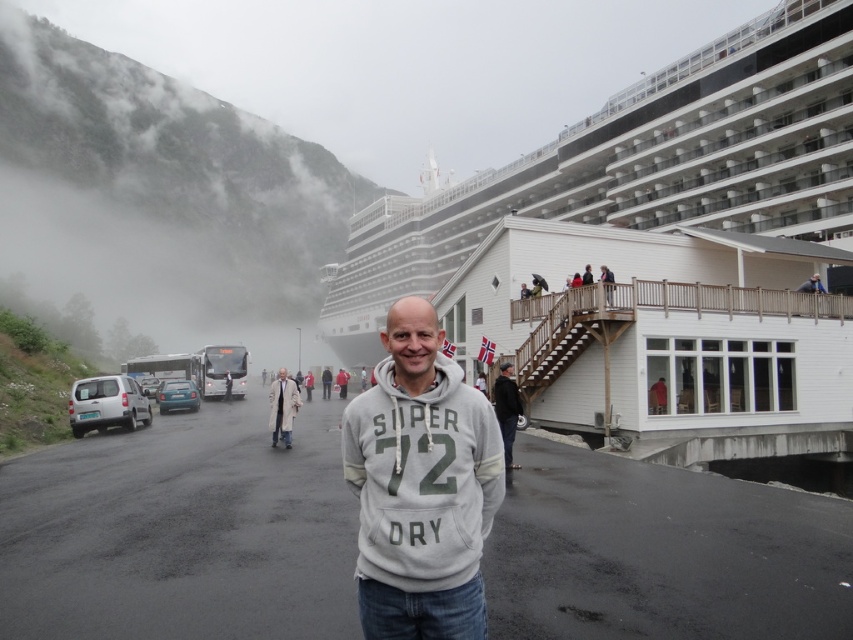
Is point (21, 220) less distant than point (120, 384)?

No.

Image resolution: width=853 pixels, height=640 pixels. I want to click on foggy misty mountain at upper left, so click(x=160, y=196).

Where is `foggy misty mountain at upper left`? The width and height of the screenshot is (853, 640). foggy misty mountain at upper left is located at coordinates point(160,196).

In the scene shown: Does gray cotton hoodie at center have a greater width compared to light brown wooden railing at upper center?

Correct, the width of gray cotton hoodie at center exceeds that of light brown wooden railing at upper center.

Which is more to the left, gray cotton hoodie at center or light brown wooden railing at upper center?

Positioned to the left is gray cotton hoodie at center.

Between point (386, 554) and point (602, 284), which one is positioned in front?

Point (386, 554) is more forward.

Locate an element on the screen. This screenshot has height=640, width=853. gray cotton hoodie at center is located at coordinates (421, 484).

Which is in front, point (181, 387) or point (328, 378)?

Positioned in front is point (181, 387).

Does green matte hatchback at center-left appear under white cotton hoodie at center?

Actually, green matte hatchback at center-left is above white cotton hoodie at center.

Which is in front, point (171, 397) or point (328, 387)?

Positioned in front is point (171, 397).

Locate an element on the screen. This screenshot has width=853, height=640. green matte hatchback at center-left is located at coordinates (177, 396).